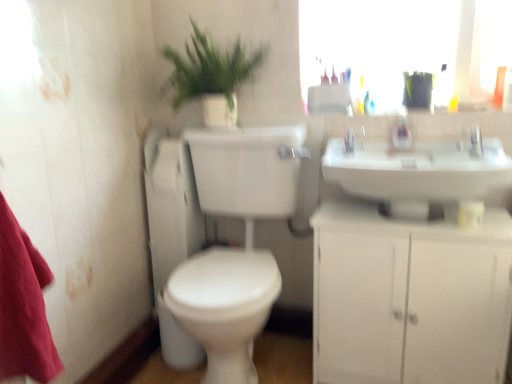
Image resolution: width=512 pixels, height=384 pixels. I want to click on white glossy toilet at center, so click(x=234, y=249).

What are the coordinates of `white matte cabinet at lower right` in the screenshot? It's located at (409, 298).

Measure the distance between silver metallic faucet at upper right and camera.

silver metallic faucet at upper right and camera are 4.62 feet apart.

The width and height of the screenshot is (512, 384). I want to click on silver metallic faucet at upper right, so pyautogui.click(x=476, y=142).

What do you see at coordinates (210, 76) in the screenshot? I see `green leafy plant at upper center` at bounding box center [210, 76].

The width and height of the screenshot is (512, 384). In order to click on green leafy plant at upper center in this screenshot , I will do `click(210, 76)`.

Describe the element at coordinates (353, 139) in the screenshot. I see `satin nickel faucet at upper center` at that location.

Image resolution: width=512 pixels, height=384 pixels. What do you see at coordinates (418, 173) in the screenshot?
I see `white glossy sink at upper right` at bounding box center [418, 173].

Find the location of a particular element. This screenshot has height=384, width=512. white glossy toilet at center is located at coordinates (234, 249).

Which of these two, silver metallic faucet at upper right or white matte cabinet at lower right, is bigger?

white matte cabinet at lower right.

Is silver metallic faucet at upper right facing away from white matte cabinet at lower right?

That's not correct — silver metallic faucet at upper right is not looking away from white matte cabinet at lower right.

Is point (480, 149) closer or farther from the camera than point (400, 281)?

Point (480, 149).

Can you confirm if silver metallic faucet at upper right is wider than white matte cabinet at lower right?

Incorrect, the width of silver metallic faucet at upper right does not surpass that of white matte cabinet at lower right.

Which object is closer to the camera taking this photo, white matte cabinet at lower right or satin nickel faucet at upper center?

white matte cabinet at lower right is in front.

Considering the relative sizes of white matte cabinet at lower right and satin nickel faucet at upper center in the image provided, is white matte cabinet at lower right taller than satin nickel faucet at upper center?

Indeed, white matte cabinet at lower right has a greater height compared to satin nickel faucet at upper center.

Is white matte cabinet at lower right touching satin nickel faucet at upper center?

No, white matte cabinet at lower right is not in contact with satin nickel faucet at upper center.

You are a GUI agent. You are given a task and a screenshot of the screen. Output one action in this format:
    pyautogui.click(x=<x>, y=<y>)
    Task: Click on the plumbing fixture above the white matte cabinet at lower right (from the image's perspective)
    The image size is (512, 384).
    Given the screenshot: What is the action you would take?
    pyautogui.click(x=353, y=139)

Is white glossy toilet at center-left oriented towards white glossy sink at upper right?

No, white glossy toilet at center-left is not aimed at white glossy sink at upper right.

From a real-world perspective, is white glossy toilet at center-left above or below white glossy sink at upper right?

Clearly, from a real-world perspective, white glossy toilet at center-left is below white glossy sink at upper right.

Considering the relative sizes of white glossy toilet at center-left and white glossy sink at upper right in the image provided, is white glossy toilet at center-left smaller than white glossy sink at upper right?

Yes, white glossy toilet at center-left is smaller than white glossy sink at upper right.

Consider the image. From the image's perspective, which one is positioned higher, white glossy toilet at center-left or white glossy sink at upper right?

white glossy sink at upper right is shown above in the image.

Between point (480, 141) and point (186, 181), which one is positioned behind?

The point (186, 181) is behind.

Based on the photo, from a real-world perspective, who is located lower, silver metallic faucet at upper right or white glossy toilet at center-left?

white glossy toilet at center-left, from a real-world perspective.

From the image's perspective, would you say silver metallic faucet at upper right is shown under white glossy toilet at center-left?

Incorrect, from the image's perspective, silver metallic faucet at upper right is higher than white glossy toilet at center-left.

The width and height of the screenshot is (512, 384). In order to click on toilet that is in front of the white glossy sink at upper right in this screenshot , I will do `click(234, 249)`.

From the picture: Can you tell me how much white glossy toilet at center and white glossy sink at upper right differ in facing direction?

The angle between the facing direction of white glossy toilet at center and the facing direction of white glossy sink at upper right is 2.5 degrees.

Does white glossy toilet at center lie behind white glossy sink at upper right?

No, white glossy toilet at center is in front of white glossy sink at upper right.

Is white glossy toilet at center oriented towards white glossy sink at upper right?

No, white glossy toilet at center does not turn towards white glossy sink at upper right.

In terms of height, does green leafy plant at upper center look taller or shorter compared to white glossy toilet at center-left?

Considering their sizes, green leafy plant at upper center has less height than white glossy toilet at center-left.

From a real-world perspective, is green leafy plant at upper center over white glossy toilet at center-left?

Yes, from a real-world perspective, green leafy plant at upper center is on top of white glossy toilet at center-left.

Can you tell me how much green leafy plant at upper center and white glossy toilet at center-left differ in facing direction?

green leafy plant at upper center and white glossy toilet at center-left are facing 0.43 degrees away from each other.

Is green leafy plant at upper center in contact with white glossy toilet at center-left?

No, green leafy plant at upper center is not in contact with white glossy toilet at center-left.

Considering the relative sizes of silver metallic faucet at upper right and white glossy sink at upper right in the image provided, is silver metallic faucet at upper right smaller than white glossy sink at upper right?

Indeed, silver metallic faucet at upper right has a smaller size compared to white glossy sink at upper right.

How different are the orientations of silver metallic faucet at upper right and white glossy sink at upper right in degrees?

The angle between the facing direction of silver metallic faucet at upper right and the facing direction of white glossy sink at upper right is 6.08e-05 degrees.

Is point (478, 136) behind point (483, 139)?

Yes, point (478, 136) is farther from viewer.

Between silver metallic faucet at upper right and white glossy sink at upper right, which one appears on the right side from the viewer's perspective?

Positioned to the right is silver metallic faucet at upper right.

Locate an element on the screen. This screenshot has width=512, height=384. bathroom cabinet that is on the left side of silver metallic faucet at upper right is located at coordinates (409, 298).

This screenshot has height=384, width=512. Identify the location of plumbing fixture above the white matte cabinet at lower right (from a real-world perspective). [353, 139].

Based on their spatial positions, is white glossy toilet at center or green leafy plant at upper center further from white matte cabinet at lower right?

green leafy plant at upper center is further to white matte cabinet at lower right.

Based on the photo, which object lies nearer to the anchor point white matte cabinet at lower right, green leafy plant at upper center or satin nickel faucet at upper center?

Based on the image, satin nickel faucet at upper center appears to be nearer to white matte cabinet at lower right.

Looking at the image, which one is located further to white glossy toilet at center-left, satin nickel faucet at upper center or white glossy toilet at center?

satin nickel faucet at upper center.

When comparing their distances from white matte cabinet at lower right, does satin nickel faucet at upper center or white glossy toilet at center seem further?

satin nickel faucet at upper center.

Based on their spatial positions, is white glossy toilet at center-left or white glossy sink at upper right closer to green leafy plant at upper center?

Based on the image, white glossy toilet at center-left appears to be nearer to green leafy plant at upper center.

Which object lies nearer to the anchor point white matte cabinet at lower right, silver metallic faucet at upper right or white glossy toilet at center?

white glossy toilet at center lies closer to white matte cabinet at lower right than the other object.

From the image, which object appears to be farther from white matte cabinet at lower right, white glossy toilet at center-left or silver metallic faucet at upper right?

white glossy toilet at center-left is further to white matte cabinet at lower right.

From the image, which object appears to be farther from white glossy toilet at center-left, white glossy sink at upper right or white matte cabinet at lower right?

Among the two, white glossy sink at upper right is located further to white glossy toilet at center-left.

At what (x,y) coordinates should I click in order to perform the action: click on houseplant between white glossy toilet at center-left and silver metallic faucet at upper right from left to right. Please return your answer as a coordinate pair (x, y). The width and height of the screenshot is (512, 384). Looking at the image, I should click on (210, 76).

The height and width of the screenshot is (384, 512). I want to click on tap between satin nickel faucet at upper center and white matte cabinet at lower right in the vertical direction, so click(476, 142).

You are a GUI agent. You are given a task and a screenshot of the screen. Output one action in this format:
    pyautogui.click(x=<x>, y=<y>)
    Task: Click on the plumbing fixture that lies between green leafy plant at upper center and white matte cabinet at lower right from top to bottom
    
    Given the screenshot: What is the action you would take?
    pyautogui.click(x=353, y=139)

In order to click on plumbing fixture between white glossy toilet at center and white matte cabinet at lower right in the horizontal direction in this screenshot , I will do coord(353,139).